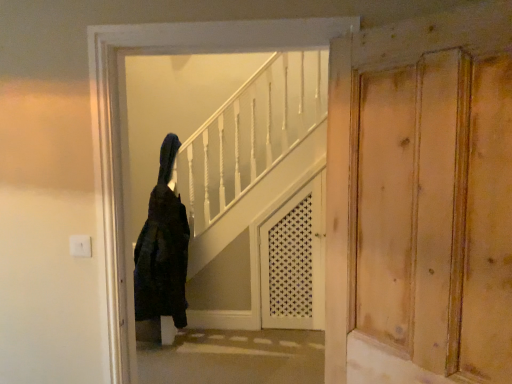
Question: From a real-world perspective, is natural wood door at right physically below black fuzzy coat at center?

Choices:
 (A) yes
 (B) no

Answer: (B)

Question: Considering the relative sizes of natural wood door at right and black fuzzy coat at center in the image provided, is natural wood door at right taller than black fuzzy coat at center?

Choices:
 (A) no
 (B) yes

Answer: (A)

Question: Could you tell me if natural wood door at right is turned towards black fuzzy coat at center?

Choices:
 (A) no
 (B) yes

Answer: (A)

Question: Does natural wood door at right have a lesser height compared to black fuzzy coat at center?

Choices:
 (A) no
 (B) yes

Answer: (B)

Question: Is natural wood door at right touching black fuzzy coat at center?

Choices:
 (A) yes
 (B) no

Answer: (B)

Question: Can you confirm if natural wood door at right is bigger than black fuzzy coat at center?

Choices:
 (A) yes
 (B) no

Answer: (B)

Question: Is white lattice screen door at center positioned in front of natural wood door at right?

Choices:
 (A) yes
 (B) no

Answer: (B)

Question: From a real-world perspective, is white lattice screen door at center on natural wood door at right?

Choices:
 (A) yes
 (B) no

Answer: (B)

Question: From the image's perspective, is white lattice screen door at center above natural wood door at right?

Choices:
 (A) no
 (B) yes

Answer: (A)

Question: Considering the relative positions of white lattice screen door at center and natural wood door at right in the image provided, is white lattice screen door at center behind natural wood door at right?

Choices:
 (A) yes
 (B) no

Answer: (A)

Question: Is white lattice screen door at center shorter than natural wood door at right?

Choices:
 (A) no
 (B) yes

Answer: (A)

Question: Is white lattice screen door at center oriented towards natural wood door at right?

Choices:
 (A) yes
 (B) no

Answer: (A)

Question: Considering the relative positions of white lattice screen door at center and black fuzzy coat at center in the image provided, is white lattice screen door at center to the right of black fuzzy coat at center from the viewer's perspective?

Choices:
 (A) no
 (B) yes

Answer: (B)